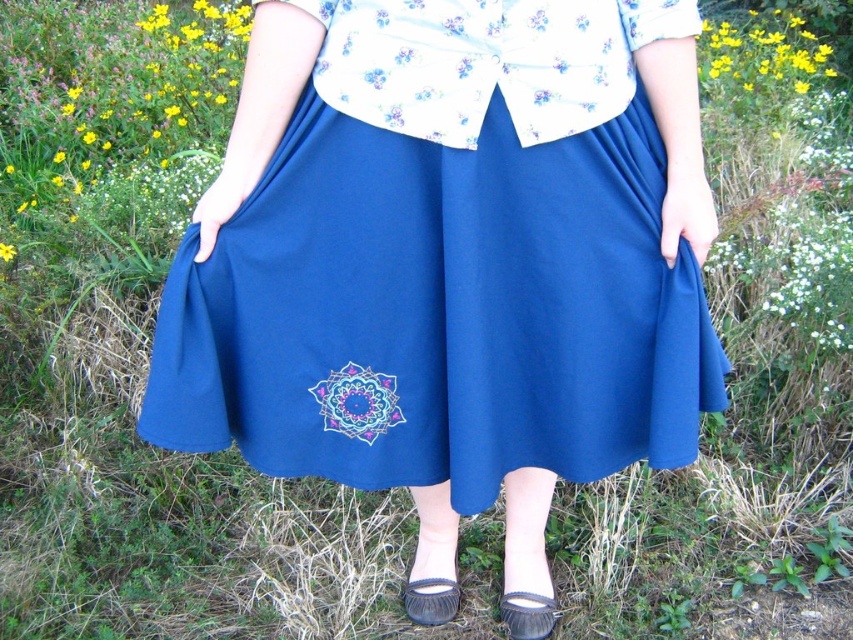
Question: Which object appears farthest from the camera in this image?

Choices:
 (A) yellow/yellowish-green petals at upper right
 (B) yellow fabric flower at upper left
 (C) matte gray sandal at lower center
 (D) matte blue skirt at center

Answer: (B)

Question: Does matte blue skirt at center appear over matte floral blouse at upper center?

Choices:
 (A) no
 (B) yes

Answer: (A)

Question: Does leather moccasin at lower center appear under matte gray sandal at lower center?

Choices:
 (A) no
 (B) yes

Answer: (A)

Question: Does yellow/yellowish-green petals at upper right come in front of yellow fabric flower at upper left?

Choices:
 (A) no
 (B) yes

Answer: (B)

Question: Which object is closer to the camera taking this photo?

Choices:
 (A) yellow fabric flower at upper left
 (B) matte gray sandal at lower center
 (C) matte blue skirt at center

Answer: (C)

Question: Estimate the real-world distances between objects in this image. Which object is closer to the matte gray sandal at lower center?

Choices:
 (A) matte blue skirt at center
 (B) yellow fabric flower at upper left

Answer: (A)